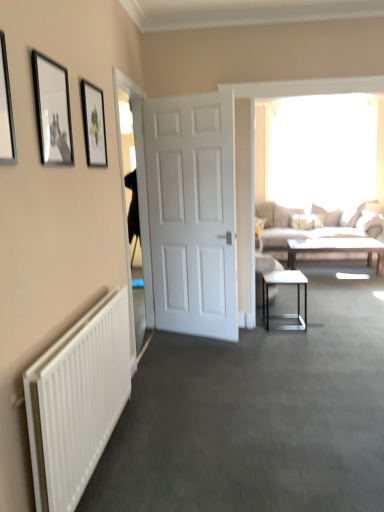
Question: Does white ribbed radiator at lower left have a lesser width compared to metallic black side table at center?

Choices:
 (A) yes
 (B) no

Answer: (A)

Question: Is white ribbed radiator at lower left aimed at metallic black side table at center?

Choices:
 (A) no
 (B) yes

Answer: (A)

Question: Can you confirm if white ribbed radiator at lower left is smaller than metallic black side table at center?

Choices:
 (A) no
 (B) yes

Answer: (A)

Question: Is white ribbed radiator at lower left wider than metallic black side table at center?

Choices:
 (A) yes
 (B) no

Answer: (B)

Question: Would you consider white ribbed radiator at lower left to be distant from metallic black side table at center?

Choices:
 (A) yes
 (B) no

Answer: (A)

Question: Does white ribbed radiator at lower left have a greater height compared to metallic black side table at center?

Choices:
 (A) yes
 (B) no

Answer: (A)

Question: Is light brown wooden coffee table at center not within metallic silver picture frame at upper left, which ranks as the 1th picture frame in left-to-right order?

Choices:
 (A) yes
 (B) no

Answer: (A)

Question: Does light brown wooden coffee table at center have a greater height compared to metallic silver picture frame at upper left, which ranks as the 1th picture frame in left-to-right order?

Choices:
 (A) yes
 (B) no

Answer: (B)

Question: Is light brown wooden coffee table at center wider than metallic silver picture frame at upper left, which ranks as the 1th picture frame in left-to-right order?

Choices:
 (A) no
 (B) yes

Answer: (B)

Question: Is light brown wooden coffee table at center looking in the opposite direction of metallic silver picture frame at upper left, the 3th picture frame viewed from the right?

Choices:
 (A) yes
 (B) no

Answer: (B)

Question: Is light brown wooden coffee table at center to the left of metallic silver picture frame at upper left, which ranks as the 1th picture frame in left-to-right order, from the viewer's perspective?

Choices:
 (A) yes
 (B) no

Answer: (B)

Question: Is light brown wooden coffee table at center aimed at metallic silver picture frame at upper left, which ranks as the 1th picture frame in left-to-right order?

Choices:
 (A) yes
 (B) no

Answer: (B)

Question: Are beige fabric couch at right and transparent glass door at left beside each other?

Choices:
 (A) yes
 (B) no

Answer: (B)